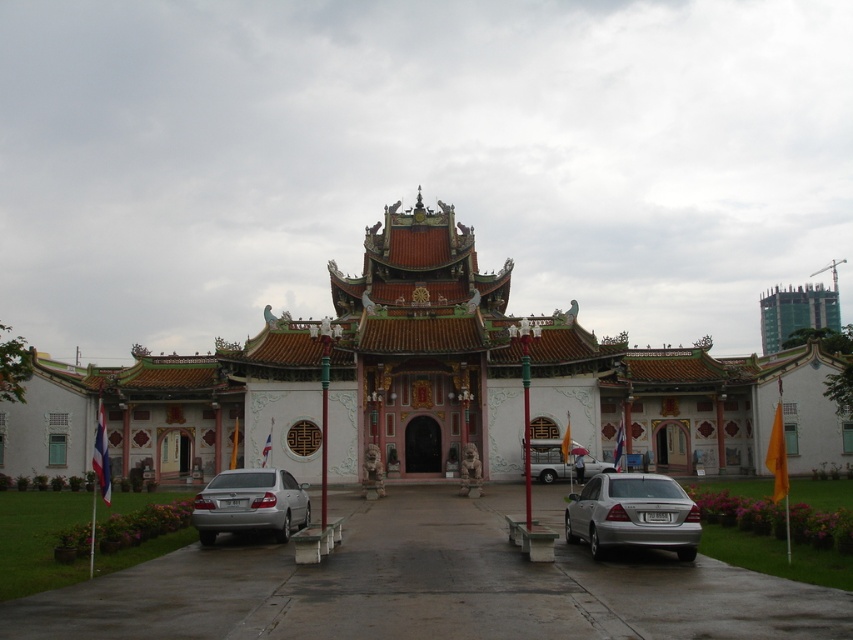
Question: Which point is farther from the camera taking this photo?

Choices:
 (A) (792, 449)
 (B) (281, 518)
 (C) (171, 621)

Answer: (A)

Question: Is green grass at center positioned in front of silver metallic sedan at center?

Choices:
 (A) no
 (B) yes

Answer: (B)

Question: Which point appears farthest from the camera in this image?

Choices:
 (A) (461, 275)
 (B) (560, 476)

Answer: (A)

Question: Can you confirm if white glossy palace at center is wider than silver metallic car at center?

Choices:
 (A) yes
 (B) no

Answer: (A)

Question: Does green grass at center have a lesser width compared to silver metallic car at center?

Choices:
 (A) yes
 (B) no

Answer: (B)

Question: Which object is closer to the camera taking this photo?

Choices:
 (A) silver metallic sedan at center
 (B) silver metallic car at center
 (C) white glossy palace at center

Answer: (A)